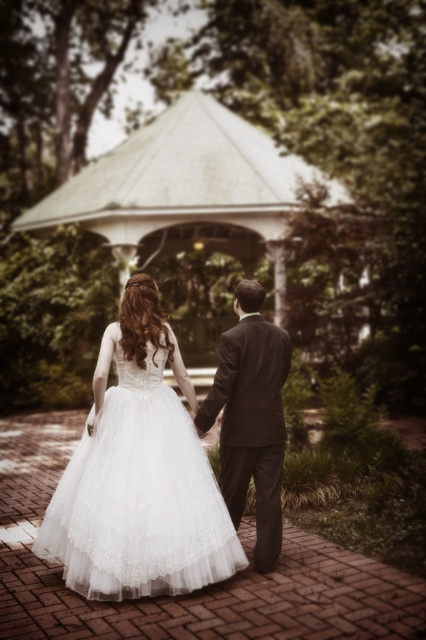
You are a photographer taking pictures of the couple walking towards the gazebo. You notice the white lace dress at center and the dark brown suit at center. Which clothing item takes up more space in your camera frame?

The white lace dress at center takes up more space in the camera frame because it is bigger than the dark brown suit at center.

You are a photographer standing at the origin point of the coordinate system. You want to take a photo of the white lace dress at center. What are the coordinates where you should focus your camera?

The coordinates to focus the camera on the white lace dress at center are at point (138, 496).